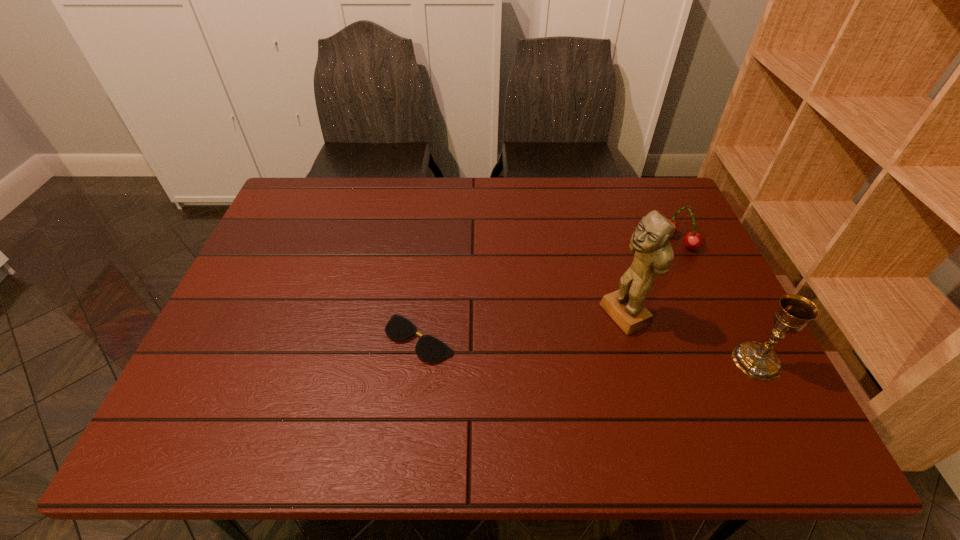
Where is `free space on the desktop that is between the spectacles and the third shortest object and is positioned on the front-facing side of the figurine`? The width and height of the screenshot is (960, 540). free space on the desktop that is between the spectacles and the third shortest object and is positioned on the front-facing side of the figurine is located at coordinates (556, 348).

Locate an element on the screen. The width and height of the screenshot is (960, 540). vacant space on the desktop that is between the shortest object and the chalice and is positioned with stems pointing upwards on the farthest object is located at coordinates (535, 346).